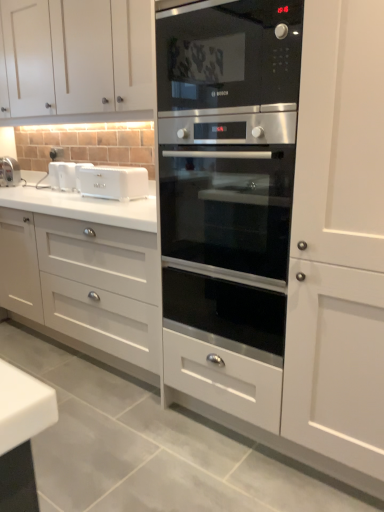
Question: Is matte white faucet at left in contact with black glass microwave at center?

Choices:
 (A) yes
 (B) no

Answer: (B)

Question: Does matte white faucet at left have a greater height compared to black glass microwave at center?

Choices:
 (A) yes
 (B) no

Answer: (B)

Question: From a real-world perspective, is matte white faucet at left over black glass microwave at center?

Choices:
 (A) yes
 (B) no

Answer: (B)

Question: Does matte white faucet at left have a lesser height compared to black glass microwave at center?

Choices:
 (A) yes
 (B) no

Answer: (A)

Question: Is matte white faucet at left facing away from black glass microwave at center?

Choices:
 (A) yes
 (B) no

Answer: (B)

Question: Does matte white faucet at left lie in front of black glass microwave at center?

Choices:
 (A) no
 (B) yes

Answer: (A)

Question: Does white plastic toaster at center, marked as the first appliance in a right-to-left arrangement, appear on the right side of white plastic toaster at left, the first appliance from the left?

Choices:
 (A) yes
 (B) no

Answer: (A)

Question: Is white plastic toaster at center, the second appliance in the back-to-front sequence, with white plastic toaster at left, acting as the 2th appliance starting from the front?

Choices:
 (A) no
 (B) yes

Answer: (A)

Question: Does white plastic toaster at center, which ranks as the 1th appliance in front-to-back order, appear on the left side of white plastic toaster at left, the first appliance from the left?

Choices:
 (A) yes
 (B) no

Answer: (B)

Question: From the image's perspective, is white plastic toaster at center, the second appliance in the back-to-front sequence, on white plastic toaster at left, acting as the 2th appliance starting from the front?

Choices:
 (A) no
 (B) yes

Answer: (A)

Question: Is white plastic toaster at center, marked as the first appliance in a right-to-left arrangement, positioned behind white plastic toaster at left, which appears as the first appliance when viewed from the back?

Choices:
 (A) no
 (B) yes

Answer: (A)

Question: Considering the relative sizes of white plastic toaster at center, marked as the first appliance in a right-to-left arrangement, and white plastic toaster at left, which appears as the first appliance when viewed from the back, in the image provided, is white plastic toaster at center, marked as the first appliance in a right-to-left arrangement, thinner than white plastic toaster at left, which appears as the first appliance when viewed from the back,?

Choices:
 (A) yes
 (B) no

Answer: (B)

Question: Can you confirm if stainless steel oven at center is thinner than white matte cabinet at upper left?

Choices:
 (A) yes
 (B) no

Answer: (B)